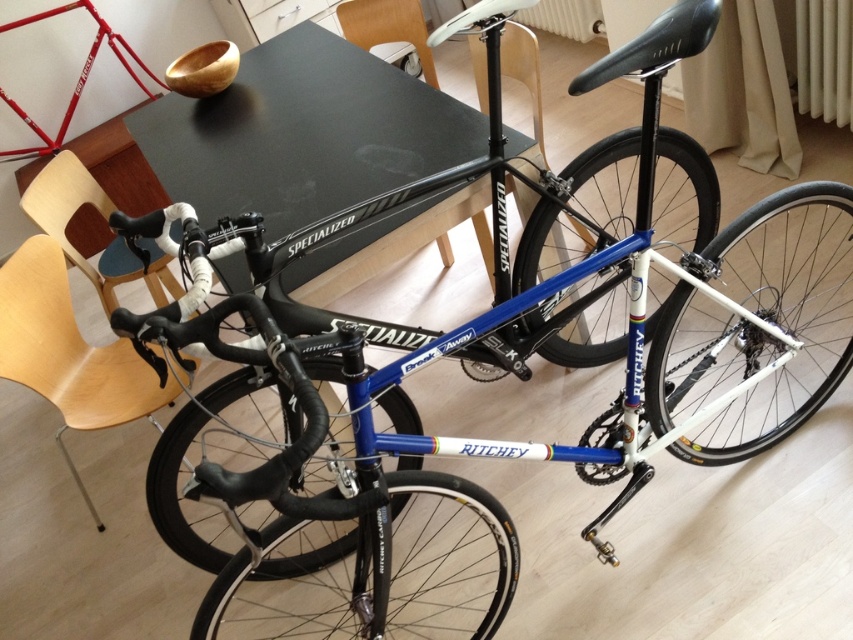
Does light wood chair at lower left have a smaller size compared to wooden chair at upper center?

Incorrect, light wood chair at lower left is not smaller in size than wooden chair at upper center.

Which is above, light wood chair at lower left or wooden chair at upper center?

wooden chair at upper center is higher up.

The height and width of the screenshot is (640, 853). What do you see at coordinates (68, 353) in the screenshot?
I see `light wood chair at lower left` at bounding box center [68, 353].

The width and height of the screenshot is (853, 640). I want to click on light wood chair at lower left, so click(x=68, y=353).

Which is more to the right, black matte table at upper center or light wood chair at lower left?

From the viewer's perspective, black matte table at upper center appears more on the right side.

This screenshot has width=853, height=640. What do you see at coordinates (303, 132) in the screenshot? I see `black matte table at upper center` at bounding box center [303, 132].

You are a GUI agent. You are given a task and a screenshot of the screen. Output one action in this format:
    pyautogui.click(x=<x>, y=<y>)
    Task: Click on the black matte table at upper center
    
    Given the screenshot: What is the action you would take?
    pyautogui.click(x=303, y=132)

You are a GUI agent. You are given a task and a screenshot of the screen. Output one action in this format:
    pyautogui.click(x=<x>, y=<y>)
    Task: Click on the black matte table at upper center
    The height and width of the screenshot is (640, 853).
    Given the screenshot: What is the action you would take?
    pyautogui.click(x=303, y=132)

Where is `black matte table at upper center`? The height and width of the screenshot is (640, 853). black matte table at upper center is located at coordinates (303, 132).

The width and height of the screenshot is (853, 640). Identify the location of black matte table at upper center. (303, 132).